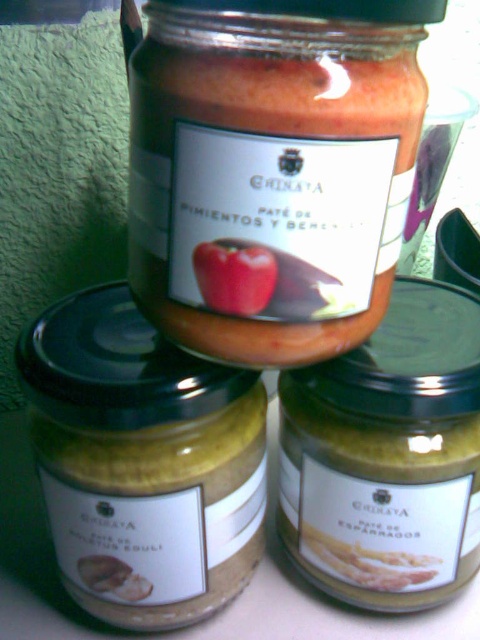
You are arranging these jars on a shelf. The shelf has a width of 15 cm. The matte yellow spread at lower left is 10 cm wide, and the red matte apple at center is 8 cm wide. Can both jars fit side by side on the shelf without overlapping?

The matte yellow spread at lower left is 10 cm wide and the red matte apple at center is 8 cm wide. Combined, their widths total 18 cm, which exceeds the shelf width of 15 cm. Therefore, both jars cannot fit side by side on the shelf without overlapping.